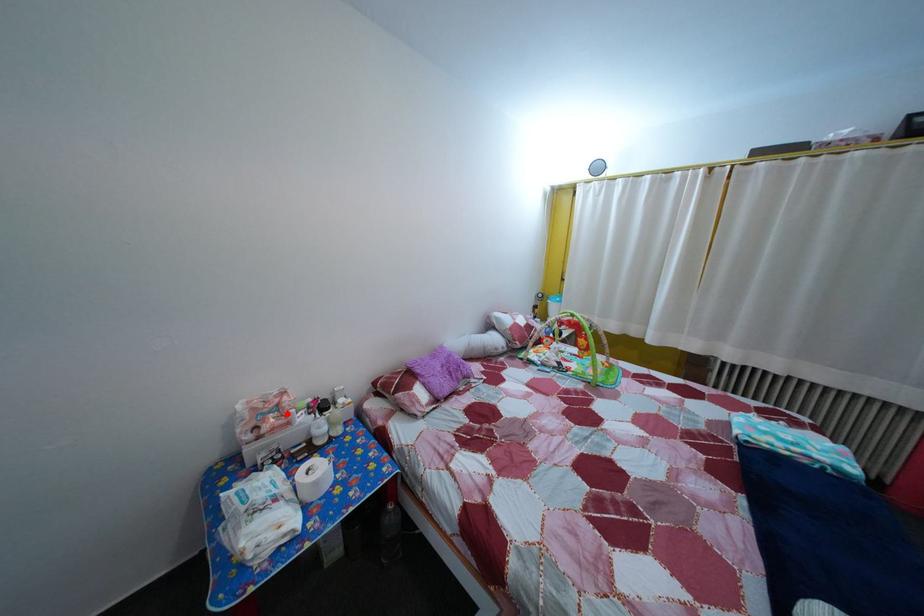
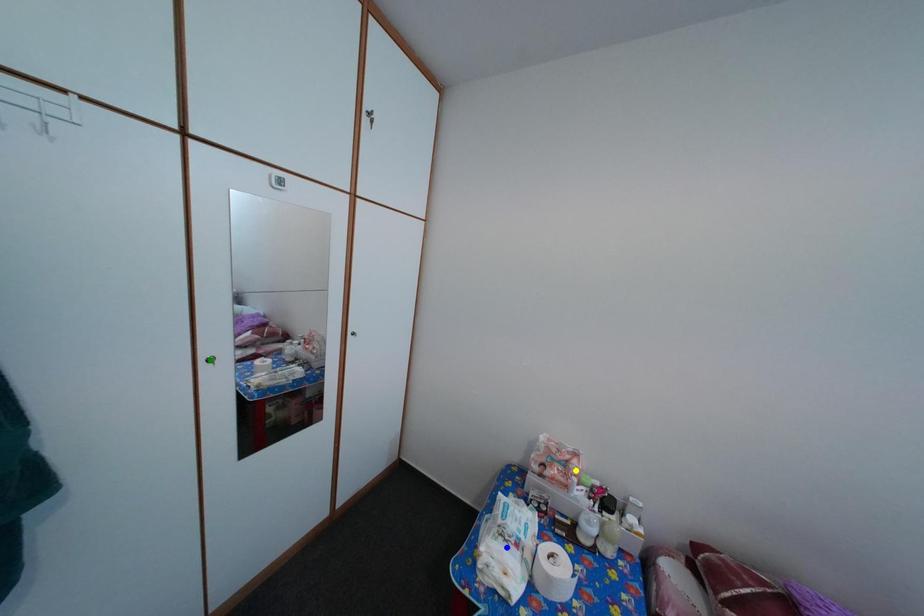
Question: I am providing you with two images of the same scene from different viewpoints. A red point is marked on the first image. You are given multiple points on the second image. In image 2, which mark is for the same physical point as the one in image 1?

Choices:
 (A) blue point
 (B) yellow point
 (C) green point

Answer: (B)